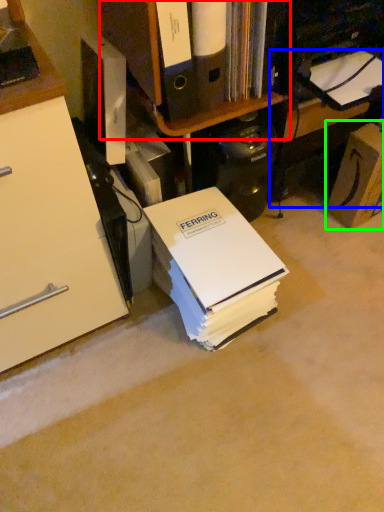
Question: Which object is positioned farthest from shelf (highlighted by a red box)? Select from computer desk (highlighted by a blue box) and cardboard box (highlighted by a green box).

Choices:
 (A) computer desk
 (B) cardboard box

Answer: (B)